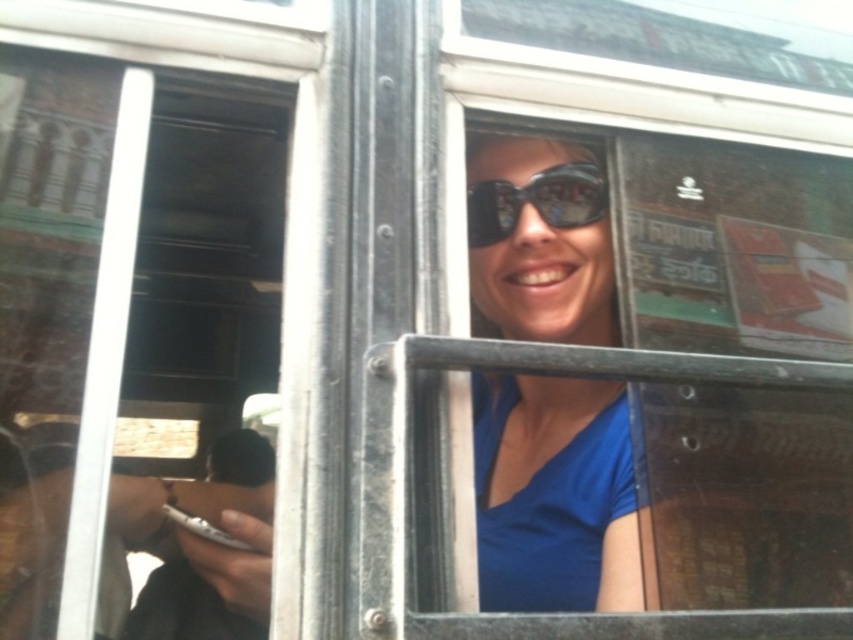
Question: Does blue matte shirt at center appear on the left side of black matte goggles at center?

Choices:
 (A) no
 (B) yes

Answer: (A)

Question: Which point appears farthest from the camera in this image?

Choices:
 (A) (560, 417)
 (B) (494, 225)

Answer: (A)

Question: Does blue matte shirt at center appear on the left side of black matte goggles at center?

Choices:
 (A) yes
 (B) no

Answer: (B)

Question: Which point is farther from the camera taking this photo?

Choices:
 (A) (582, 164)
 (B) (482, 292)

Answer: (B)

Question: Which point is farther to the camera?

Choices:
 (A) black matte goggles at center
 (B) blue matte shirt at center

Answer: (A)

Question: Is blue matte shirt at center positioned behind black matte goggles at center?

Choices:
 (A) no
 (B) yes

Answer: (A)